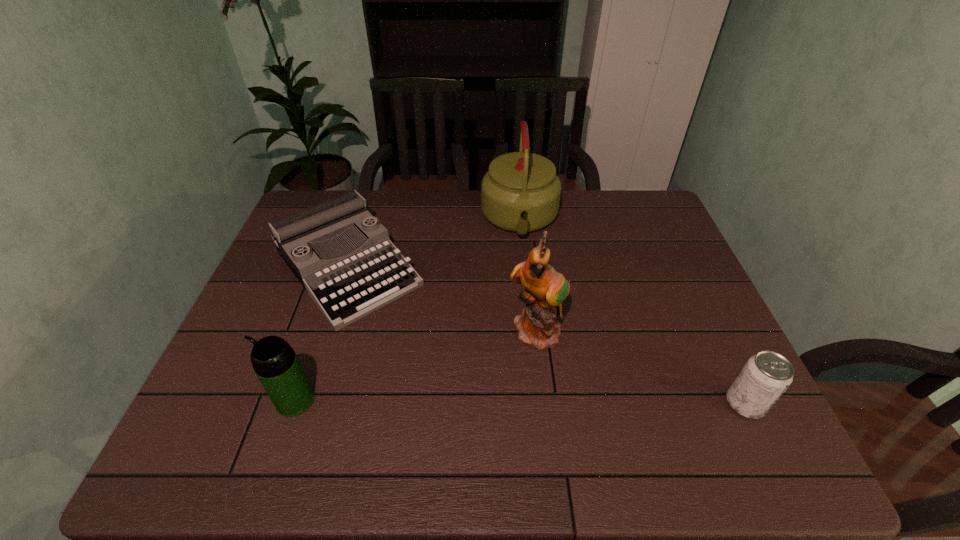
What are the coordinates of `object situated at the right edge` in the screenshot? It's located at (766, 375).

I want to click on object that is at the far left corner, so click(346, 285).

This screenshot has height=540, width=960. In order to click on object that is at the near left corner in this screenshot , I will do pos(274,361).

The width and height of the screenshot is (960, 540). Identify the location of object that is at the near right corner. (766, 375).

In the image, there is a desktop. Where is `vacant region at the far edge`? The height and width of the screenshot is (540, 960). vacant region at the far edge is located at coordinates (408, 232).

Identify the location of vacant space at the near edge. (585, 414).

Locate an element on the screen. free space at the left edge of the desktop is located at coordinates (295, 312).

The image size is (960, 540). In the image, there is a desktop. Identify the location of blank space at the right edge. (670, 362).

At what (x,y) coordinates should I click in order to perform the action: click on vacant area at the far right corner. Please return your answer as a coordinate pair (x, y). This screenshot has width=960, height=540. Looking at the image, I should click on (660, 206).

This screenshot has width=960, height=540. In the image, there is a desktop. What are the coordinates of `vacant region at the near right corner` in the screenshot? It's located at (720, 413).